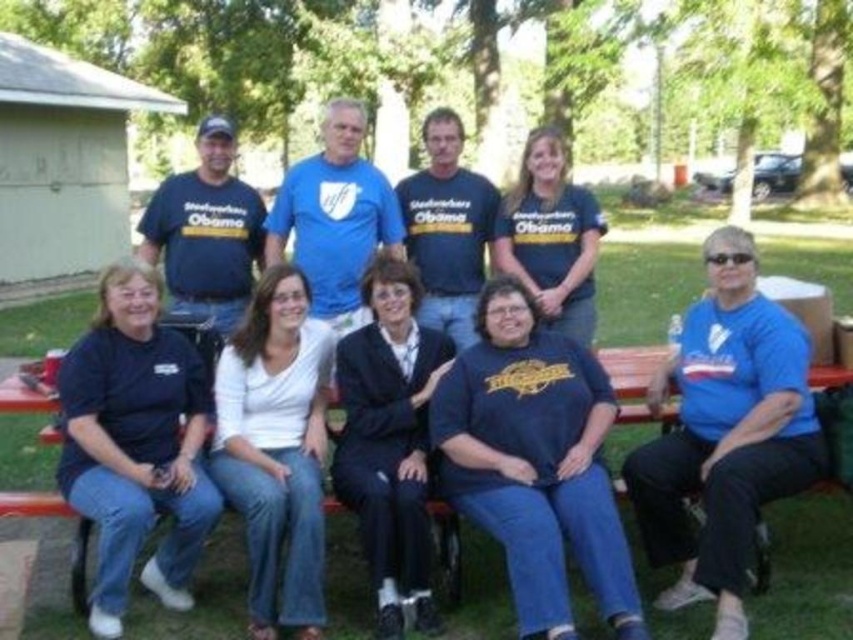
Is matte black shirt at lower left thinner than navy blue suit at center?

No, matte black shirt at lower left is not thinner than navy blue suit at center.

Between matte black shirt at lower left and navy blue suit at center, which one is positioned higher?

navy blue suit at center is above.

Find the location of `matte black shirt at lower left`. matte black shirt at lower left is located at coordinates (135, 444).

Can you confirm if blue matte shirt at lower right is thinner than matte black shirt at lower left?

In fact, blue matte shirt at lower right might be wider than matte black shirt at lower left.

Between blue matte shirt at lower right and matte black shirt at lower left, which one appears on the right side from the viewer's perspective?

From the viewer's perspective, blue matte shirt at lower right appears more on the right side.

Identify the location of blue matte shirt at lower right. (724, 433).

Which is more to the left, matte black shirt at lower left or wooden park bench at lower center?

matte black shirt at lower left is more to the left.

Is matte black shirt at lower left taller than wooden park bench at lower center?

Yes.

Is point (86, 353) positioned after point (622, 353)?

No, it is not.

Locate an element on the screen. The height and width of the screenshot is (640, 853). matte black shirt at lower left is located at coordinates (135, 444).